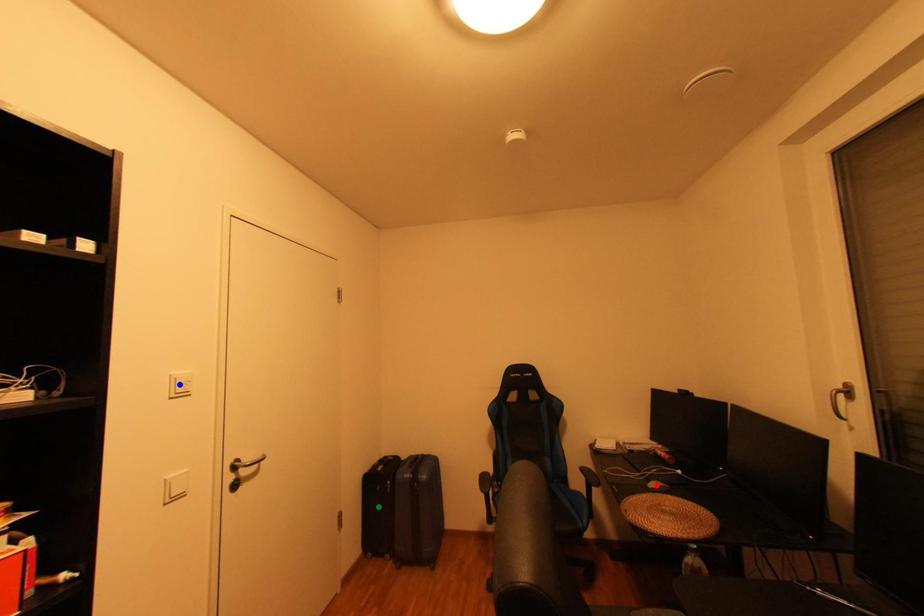
Order these from nearest to farthest:
red point
green point
blue point

blue point
red point
green point